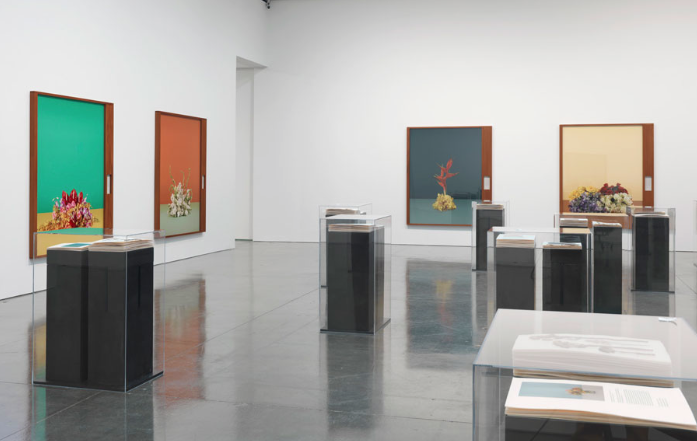
Where is `glass`? glass is located at coordinates (385, 228).